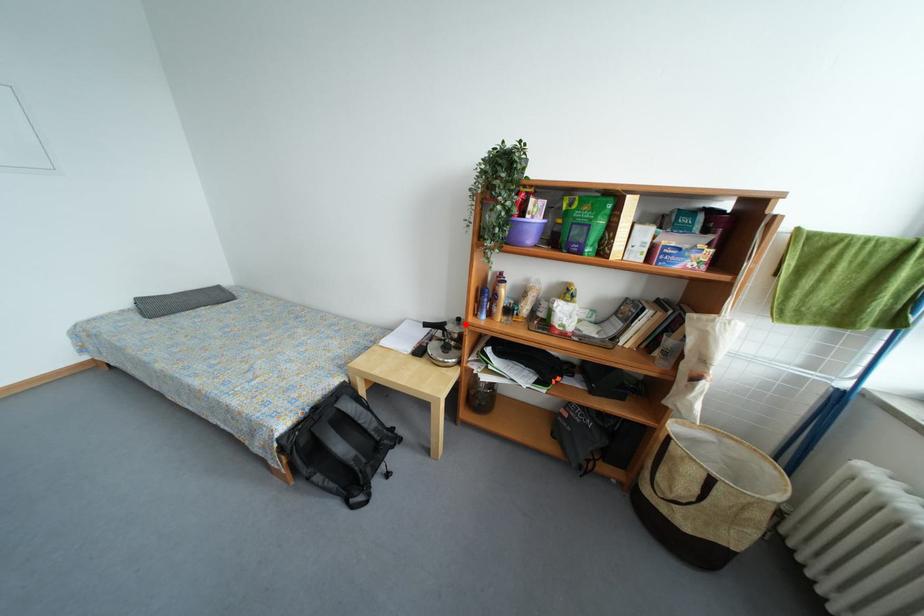
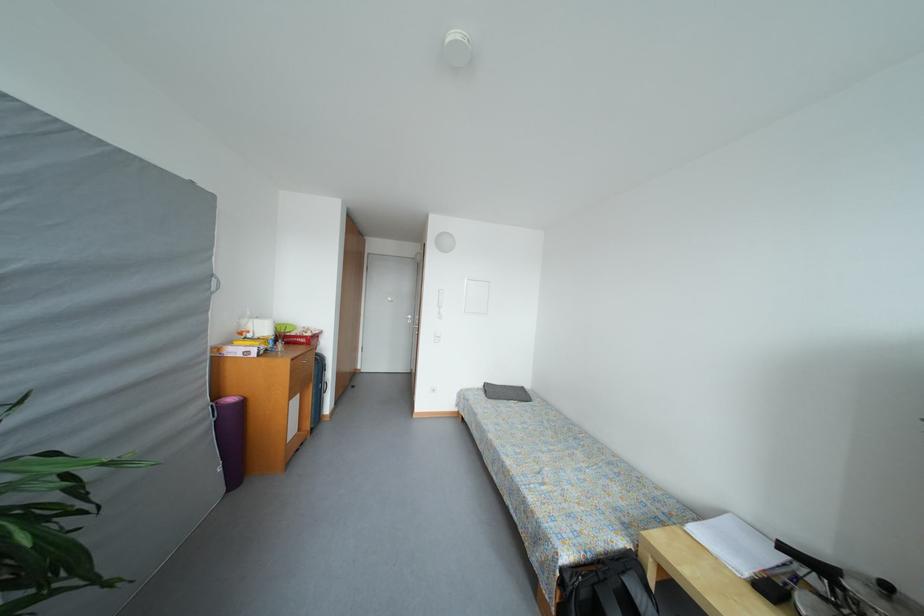
Locate, in the second image, the point that corresponds to the highlighted location in the first image.

(893, 591)